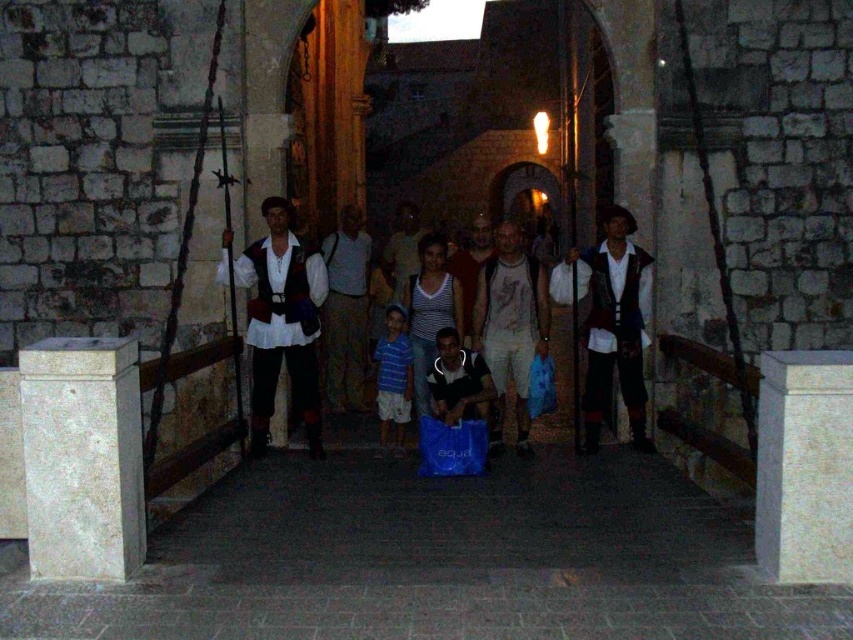
You are a tour guide leading a group on the stone bridge. You need to ensure everyone stays within a 2 meter distance for safety. Are the two people wearing white cotton shirt at center and striped cotton shirt at center within the safe distance?

The white cotton shirt at center and striped cotton shirt at center are 2.20 meters apart from each other, which exceeds the 2 meter safety distance. Therefore, they are not within the safe distance.

You are standing on the stone bridge at night and see two points marked in the scene. The first point is at coordinate point[106,436] and the second point is at coordinate point[404,381]. Which point is closer to you?

Point[106,436] is in front of point[404,381], so it is closer to you.